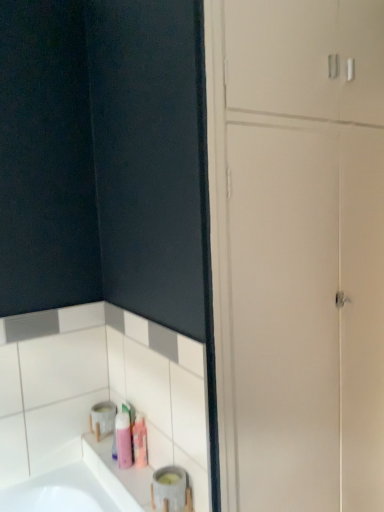
This screenshot has height=512, width=384. What do you see at coordinates (118, 475) in the screenshot? I see `matte gray container at lower left` at bounding box center [118, 475].

What is the approximate height of white glossy dresser at lower left?

white glossy dresser at lower left is 2.44 meters in height.

Identify the location of matte gray container at lower left. This screenshot has width=384, height=512. (118, 475).

Based on their positions, is pink matte bottle at lower left, which is counted as the 1th toiletry, starting from the left, located to the left or right of pink matte toiletry at lower center, positioned as the first toiletry in right-to-left order?

pink matte bottle at lower left, which is counted as the 1th toiletry, starting from the left, is positioned on pink matte toiletry at lower center, positioned as the first toiletry in right-to-left order,'s left side.

In terms of size, does pink matte bottle at lower left, which is counted as the 1th toiletry, starting from the left, appear bigger or smaller than pink matte toiletry at lower center, positioned as the first toiletry in right-to-left order?

Clearly, pink matte bottle at lower left, which is counted as the 1th toiletry, starting from the left, is larger in size than pink matte toiletry at lower center, positioned as the first toiletry in right-to-left order.

Which is nearer, (128,422) or (136,423)?

Point (136,423)

Could you tell me if pink matte bottle at lower left, which is counted as the 1th toiletry, starting from the left, is turned towards pink matte toiletry at lower center, the second toiletry from the left?

No.

Measure the distance from pink matte bottle at lower left, which appears as the 2th toiletry when viewed from the right, to matte gray container at lower left.

The distance of pink matte bottle at lower left, which appears as the 2th toiletry when viewed from the right, from matte gray container at lower left is 4.05 inches.

Looking at this image, from the image's perspective, which is below, pink matte bottle at lower left, which appears as the 2th toiletry when viewed from the right, or matte gray container at lower left?

matte gray container at lower left is shown below in the image.

From a real-world perspective, is pink matte bottle at lower left, which appears as the 2th toiletry when viewed from the right, positioned above or below matte gray container at lower left?

In terms of real-world spatial position, pink matte bottle at lower left, which appears as the 2th toiletry when viewed from the right, is above matte gray container at lower left.

This screenshot has height=512, width=384. I want to click on counter top lying on the right of pink matte bottle at lower left, which appears as the 2th toiletry when viewed from the right, so click(118, 475).

Does white glossy dresser at lower left contain pink matte toiletry at lower center, the second toiletry from the left?

No, pink matte toiletry at lower center, the second toiletry from the left, is located outside of white glossy dresser at lower left.

Is white glossy dresser at lower left beside pink matte toiletry at lower center, the second toiletry from the left?

No, white glossy dresser at lower left is not in contact with pink matte toiletry at lower center, the second toiletry from the left.

Between white glossy dresser at lower left and pink matte toiletry at lower center, the second toiletry from the left, which one appears on the right side from the viewer's perspective?

white glossy dresser at lower left is more to the right.

Which is in front, point (264, 166) or point (143, 429)?

The point (264, 166) is closer.

Is matte gray container at lower left next to pink matte toiletry at lower center, the second toiletry from the left, and touching it?

No, matte gray container at lower left is not in contact with pink matte toiletry at lower center, the second toiletry from the left.

Considering the points (119, 479) and (141, 439), which point is behind, point (119, 479) or point (141, 439)?

Positioned behind is point (141, 439).

Is matte gray container at lower left positioned beyond the bounds of pink matte toiletry at lower center, the second toiletry from the left?

Yes, matte gray container at lower left is not within pink matte toiletry at lower center, the second toiletry from the left.

Consider the image. Who is smaller, matte gray container at lower left or pink matte toiletry at lower center, positioned as the first toiletry in right-to-left order?

pink matte toiletry at lower center, positioned as the first toiletry in right-to-left order, is smaller.

Looking at this image, who is shorter, pink matte toiletry at lower center, the second toiletry from the left, or matte gray container at lower left?

With less height is matte gray container at lower left.

Which object is positioned more to the left, pink matte toiletry at lower center, positioned as the first toiletry in right-to-left order, or matte gray container at lower left?

matte gray container at lower left is more to the left.

Between pink matte toiletry at lower center, positioned as the first toiletry in right-to-left order, and matte gray container at lower left, which one has smaller size?

With smaller size is pink matte toiletry at lower center, positioned as the first toiletry in right-to-left order.

From the image's perspective, which one is positioned higher, pink matte toiletry at lower center, the second toiletry from the left, or matte gray container at lower left?

pink matte toiletry at lower center, the second toiletry from the left, appears higher in the image.

How different are the orientations of matte gray container at lower left and pink matte bottle at lower left, which is counted as the 1th toiletry, starting from the left, in degrees?

The angular difference between matte gray container at lower left and pink matte bottle at lower left, which is counted as the 1th toiletry, starting from the left, is 0.06 degrees.

Considering the relative sizes of matte gray container at lower left and pink matte bottle at lower left, which appears as the 2th toiletry when viewed from the right, in the image provided, is matte gray container at lower left taller than pink matte bottle at lower left, which appears as the 2th toiletry when viewed from the right,?

No.

Considering the relative positions of matte gray container at lower left and pink matte bottle at lower left, which is counted as the 1th toiletry, starting from the left, in the image provided, is matte gray container at lower left to the left or to the right of pink matte bottle at lower left, which is counted as the 1th toiletry, starting from the left,?

matte gray container at lower left is to the right of pink matte bottle at lower left, which is counted as the 1th toiletry, starting from the left.

I want to click on toiletry that is the 1st one when counting upward from the matte gray container at lower left (from the image's perspective), so click(123, 440).

Based on their positions, is white glossy dresser at lower left located to the left or right of matte gray container at lower left?

Clearly, white glossy dresser at lower left is on the right of matte gray container at lower left in the image.

Where is `dresser above the matte gray container at lower left (from a real-world perspective)`? dresser above the matte gray container at lower left (from a real-world perspective) is located at coordinates (297, 251).

From the picture: Considering the sizes of objects white glossy dresser at lower left and matte gray container at lower left in the image provided, who is taller, white glossy dresser at lower left or matte gray container at lower left?

white glossy dresser at lower left.

From the image's perspective, is white glossy dresser at lower left located above or below matte gray container at lower left?

white glossy dresser at lower left is situated higher than matte gray container at lower left in the image.

Locate an element on the screen. The width and height of the screenshot is (384, 512). toiletry behind the pink matte bottle at lower left, which appears as the 2th toiletry when viewed from the right is located at coordinates (140, 441).

You are a GUI agent. You are given a task and a screenshot of the screen. Output one action in this format:
    pyautogui.click(x=<x>, y=<y>)
    Task: Click on the toiletry lying on the left of matte gray container at lower left
    
    Given the screenshot: What is the action you would take?
    pyautogui.click(x=123, y=440)

Which object lies further to the anchor point pink matte bottle at lower left, which is counted as the 1th toiletry, starting from the left, pink matte toiletry at lower center, positioned as the first toiletry in right-to-left order, or white glossy dresser at lower left?

The object further to pink matte bottle at lower left, which is counted as the 1th toiletry, starting from the left, is white glossy dresser at lower left.

Based on their spatial positions, is white glossy dresser at lower left or pink matte bottle at lower left, which appears as the 2th toiletry when viewed from the right, further from pink matte toiletry at lower center, positioned as the first toiletry in right-to-left order?

white glossy dresser at lower left lies further to pink matte toiletry at lower center, positioned as the first toiletry in right-to-left order, than the other object.

When comparing their distances from pink matte toiletry at lower center, positioned as the first toiletry in right-to-left order, does pink matte bottle at lower left, which is counted as the 1th toiletry, starting from the left, or matte gray container at lower left seem further?

matte gray container at lower left lies further to pink matte toiletry at lower center, positioned as the first toiletry in right-to-left order, than the other object.

From the image, which object appears to be farther from matte gray container at lower left, white glossy dresser at lower left or pink matte toiletry at lower center, positioned as the first toiletry in right-to-left order?

Among the two, white glossy dresser at lower left is located further to matte gray container at lower left.

Estimate the real-world distances between objects in this image. Which object is closer to white glossy dresser at lower left, pink matte bottle at lower left, which is counted as the 1th toiletry, starting from the left, or pink matte toiletry at lower center, the second toiletry from the left?

The object closer to white glossy dresser at lower left is pink matte toiletry at lower center, the second toiletry from the left.

From the picture: When comparing their distances from pink matte toiletry at lower center, positioned as the first toiletry in right-to-left order, does pink matte bottle at lower left, which appears as the 2th toiletry when viewed from the right, or white glossy dresser at lower left seem further?

white glossy dresser at lower left lies further to pink matte toiletry at lower center, positioned as the first toiletry in right-to-left order, than the other object.

Based on their spatial positions, is pink matte toiletry at lower center, the second toiletry from the left, or matte gray container at lower left closer to white glossy dresser at lower left?

The object closer to white glossy dresser at lower left is matte gray container at lower left.

Looking at the image, which one is located closer to pink matte bottle at lower left, which appears as the 2th toiletry when viewed from the right, matte gray container at lower left or white glossy dresser at lower left?

matte gray container at lower left.

The image size is (384, 512). What are the coordinates of `toiletry between matte gray container at lower left and pink matte toiletry at lower center, positioned as the first toiletry in right-to-left order, along the z-axis` in the screenshot? It's located at coord(123,440).

You are a GUI agent. You are given a task and a screenshot of the screen. Output one action in this format:
    pyautogui.click(x=<x>, y=<y>)
    Task: Click on the toiletry between pink matte bottle at lower left, which is counted as the 1th toiletry, starting from the left, and white glossy dresser at lower left from left to right
    
    Given the screenshot: What is the action you would take?
    pyautogui.click(x=140, y=441)